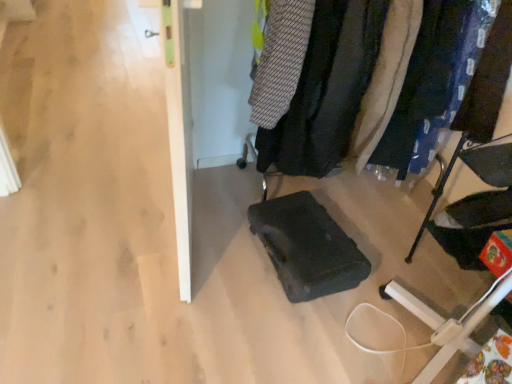
Identify the location of vacant space in front of velvet black coat at center. The height and width of the screenshot is (384, 512). (361, 281).